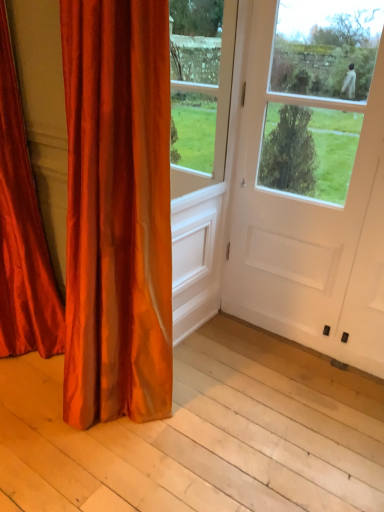
Question: From the image's perspective, does satin orange curtain at left, the 2th curtain positioned from the left, appear lower than smooth wood plank at lower left?

Choices:
 (A) no
 (B) yes

Answer: (A)

Question: Does satin orange curtain at left, which appears as the first curtain when viewed from the right, lie in front of smooth wood plank at lower left?

Choices:
 (A) no
 (B) yes

Answer: (B)

Question: Is smooth wood plank at lower left completely or partially inside satin orange curtain at left, the 2th curtain positioned from the left?

Choices:
 (A) yes
 (B) no

Answer: (B)

Question: From the image's perspective, is satin orange curtain at left, the 2th curtain positioned from the left, over smooth wood plank at lower left?

Choices:
 (A) yes
 (B) no

Answer: (A)

Question: Does satin orange curtain at left, the 2th curtain positioned from the left, turn towards smooth wood plank at lower left?

Choices:
 (A) no
 (B) yes

Answer: (B)

Question: From the image's perspective, relative to satin orange curtain at left, the 2th curtain positioned from the left, is smooth wood plank at lower left above or below?

Choices:
 (A) below
 (B) above

Answer: (A)

Question: Choose the correct answer: Is smooth wood plank at lower left inside satin orange curtain at left, the 2th curtain positioned from the left, or outside it?

Choices:
 (A) inside
 (B) outside

Answer: (B)

Question: Is smooth wood plank at lower left taller or shorter than satin orange curtain at left, which appears as the first curtain when viewed from the right?

Choices:
 (A) tall
 (B) short

Answer: (B)

Question: In the image, is smooth wood plank at lower left on the left side or the right side of satin orange curtain at left, which appears as the first curtain when viewed from the right?

Choices:
 (A) left
 (B) right

Answer: (A)

Question: Do you think satin orange curtain at left, the 2th curtain positioned from the left, is within satin red curtain at left, placed as the second curtain when sorted from right to left, or outside of it?

Choices:
 (A) outside
 (B) inside

Answer: (A)

Question: From a real-world perspective, is satin orange curtain at left, the 2th curtain positioned from the left, above or below satin red curtain at left, placed as the second curtain when sorted from right to left?

Choices:
 (A) below
 (B) above

Answer: (A)

Question: Considering the positions of satin orange curtain at left, which appears as the first curtain when viewed from the right, and satin red curtain at left, which ranks as the first curtain in left-to-right order, in the image, is satin orange curtain at left, which appears as the first curtain when viewed from the right, taller or shorter than satin red curtain at left, which ranks as the first curtain in left-to-right order,?

Choices:
 (A) short
 (B) tall

Answer: (B)

Question: Is satin orange curtain at left, the 2th curtain positioned from the left, in front of or behind satin red curtain at left, which ranks as the first curtain in left-to-right order, in the image?

Choices:
 (A) behind
 (B) front

Answer: (B)

Question: In terms of height, does satin orange curtain at left, which appears as the first curtain when viewed from the right, look taller or shorter compared to white matte door at center?

Choices:
 (A) tall
 (B) short

Answer: (B)

Question: Relative to white matte door at center, is satin orange curtain at left, the 2th curtain positioned from the left, in front or behind?

Choices:
 (A) front
 (B) behind

Answer: (A)